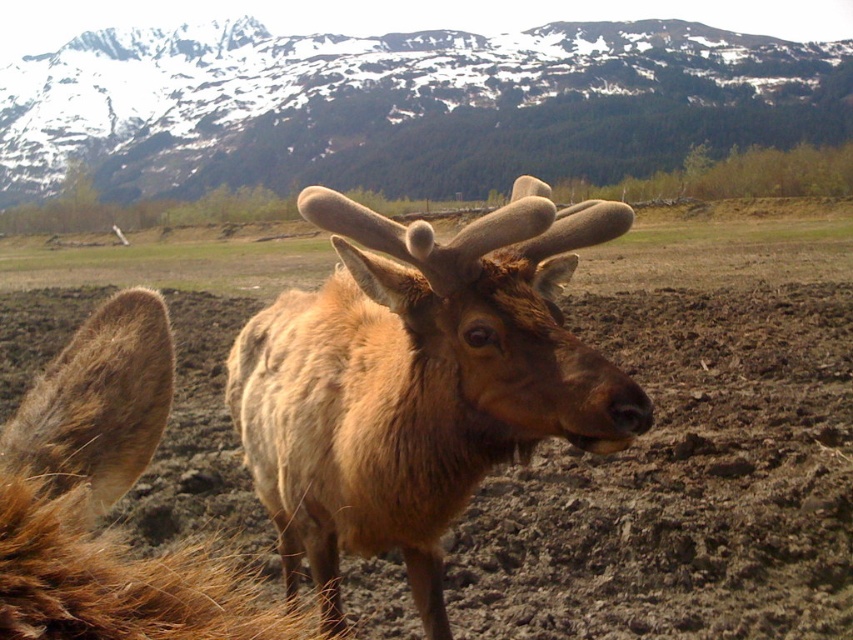
Question: Which of the following is the closest to the observer?

Choices:
 (A) (210, 236)
 (B) (86, 387)

Answer: (B)

Question: Which point is farther to the camera?

Choices:
 (A) (166, 362)
 (B) (419, 326)

Answer: (B)

Question: Which of the following is the farthest from the observer?

Choices:
 (A) snowy rock mountain at upper center
 (B) brown velvet antlers at center
 (C) brown fuzzy deer at center
 (D) brown muddy field at center

Answer: (A)

Question: In this image, where is brown velvet antlers at center located relative to brown fuzzy deer at center?

Choices:
 (A) below
 (B) above

Answer: (A)

Question: Does brown velvet antlers at center have a lesser width compared to brown fuzzy deer at center?

Choices:
 (A) yes
 (B) no

Answer: (B)

Question: Is snowy rock mountain at upper center to the left of brown fuzzy deer at center from the viewer's perspective?

Choices:
 (A) yes
 (B) no

Answer: (A)